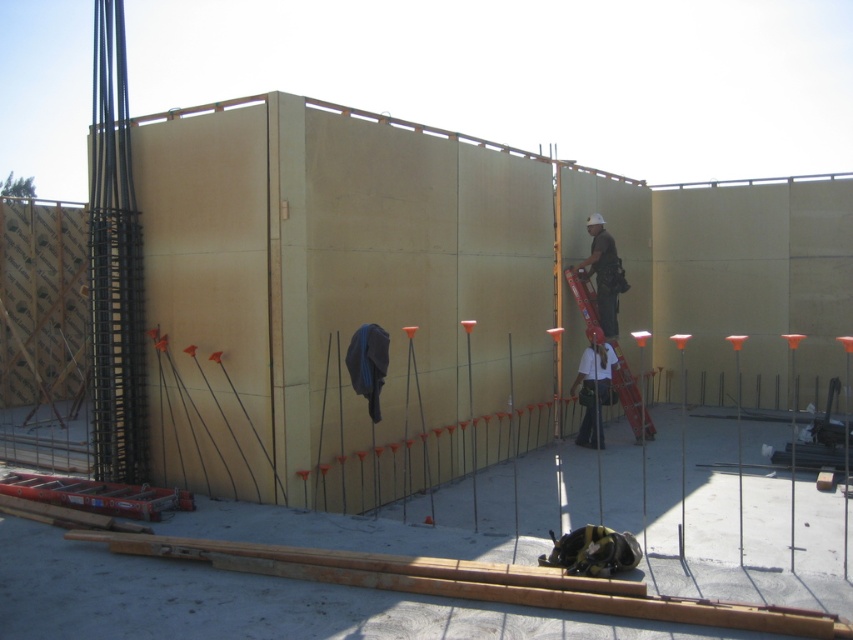
You are standing at the construction site and want to reach the point marked at coordinates (605,385). The safety regulations state that you must stay within 10 meters of your current position. Can you safely reach the point without violating the safety distance?

The point at coordinates (605,385) is 11.04 meters away from your current position, which exceeds the 10 meters safety regulation. Therefore, you cannot safely reach the point without violating the safety distance.

Based on the coordinates provided, which worker is located at point (593, 388)?

The point corresponds to the white fabric construction worker at center.

Based on the photo, you are a safety inspector at the construction site. You notice the metallic red ladder at center and the matte white helmet at center. According to safety protocols, the ladder must be positioned so that the helmet is above it. Is the current arrangement compliant with safety standards?

The metallic red ladder at center is below the matte white helmet at center, so the current arrangement complies with the safety standards requiring the helmet to be above the ladder.